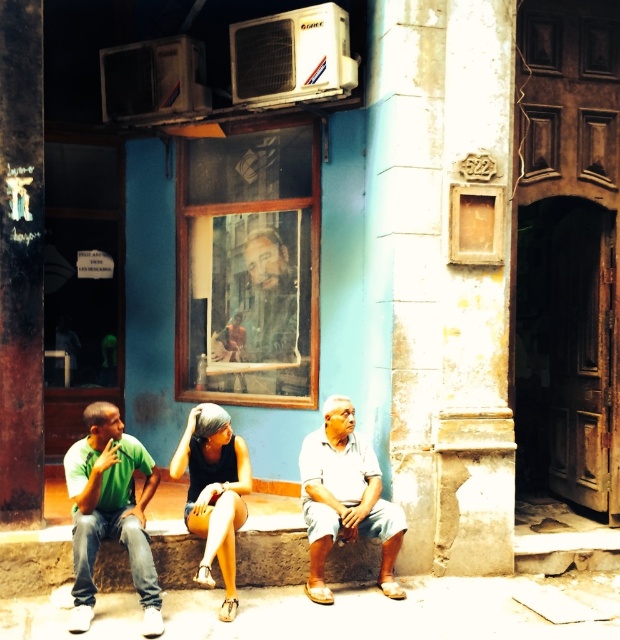
Which of these two, matte black tank top at center or green matte shirt at left, stands taller?

Standing taller between the two is green matte shirt at left.

Which is in front, point (223, 531) or point (156, 579)?

Positioned in front is point (223, 531).

The image size is (620, 640). I want to click on matte black tank top at center, so click(108, 512).

The width and height of the screenshot is (620, 640). Describe the element at coordinates (108, 512) in the screenshot. I see `matte black tank top at center` at that location.

Does matte black tank top at center have a greater width compared to smooth wooden frame at center?

Correct, the width of matte black tank top at center exceeds that of smooth wooden frame at center.

Between point (117, 492) and point (249, 243), which one is positioned behind?

The point (249, 243) is more distant.

The height and width of the screenshot is (640, 620). What are the coordinates of `matte black tank top at center` in the screenshot? It's located at (108, 512).

Who is lower down, matte black tank top at center or light blue cotton shorts at lower center?

Positioned lower is matte black tank top at center.

Who is taller, matte black tank top at center or light blue cotton shorts at lower center?

light blue cotton shorts at lower center

Who is more forward, (x=219, y=472) or (x=341, y=472)?

Positioned in front is point (x=219, y=472).

I want to click on matte black tank top at center, so click(x=108, y=512).